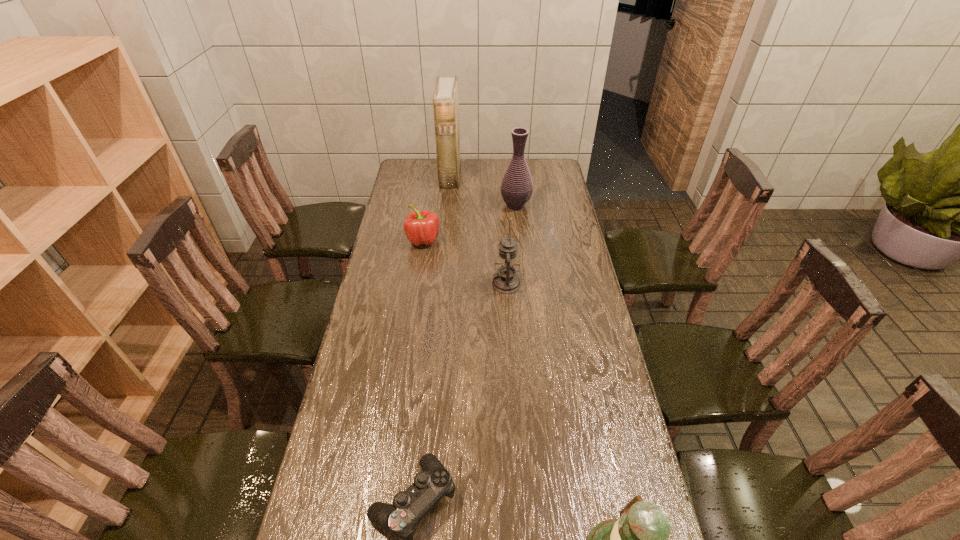
Where is `vacant space located 0.370m on the front of the oil lamp`? vacant space located 0.370m on the front of the oil lamp is located at coordinates (513, 384).

Find the location of a particular element. The image size is (960, 540). free region located on the right of the fourth nearest object is located at coordinates (474, 240).

Locate an element on the screen. The image size is (960, 540). object situated at the far edge is located at coordinates (445, 101).

The width and height of the screenshot is (960, 540). What are the coordinates of `object present at the left edge` in the screenshot? It's located at (421, 228).

The image size is (960, 540). In order to click on vacant space at the far edge of the desktop in this screenshot , I will do `click(486, 171)`.

Where is `vacant space at the left edge of the desktop`? vacant space at the left edge of the desktop is located at coordinates (366, 314).

Identify the location of vacant space at the right edge of the desktop. (543, 222).

Image resolution: width=960 pixels, height=540 pixels. In order to click on empty location between the third farthest object and the oil lamp in this screenshot , I will do `click(465, 262)`.

Locate an element on the screen. The height and width of the screenshot is (540, 960). free space between the fifth tallest object and the fourth shortest object is located at coordinates (465, 262).

Identify the location of vacant area that lies between the third tallest object and the phonebook. (478, 229).